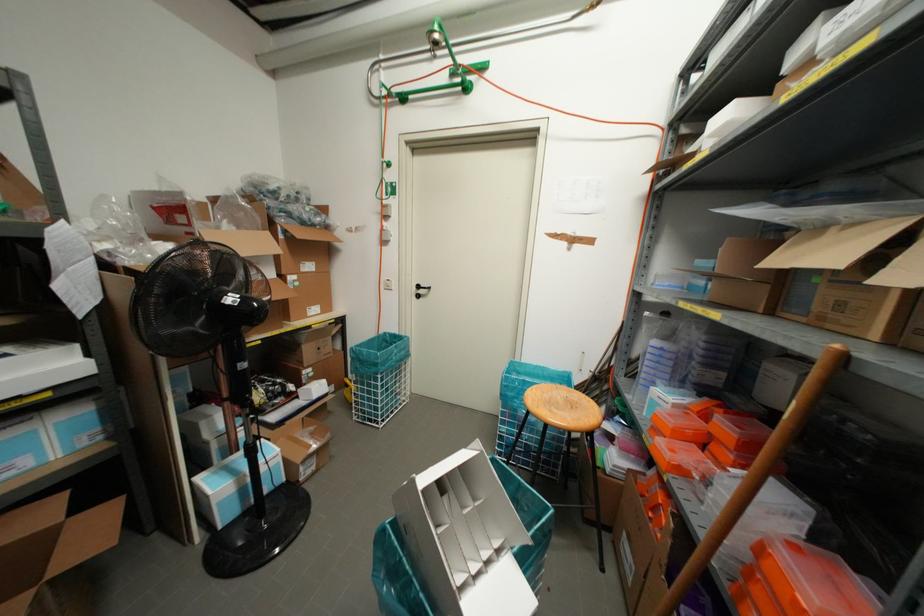
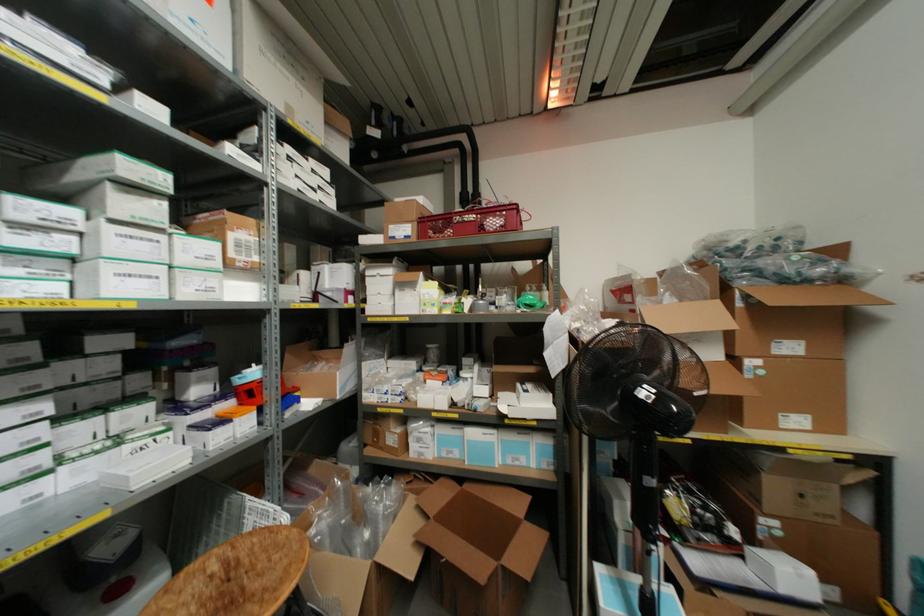
Question: The images are taken continuously from a first-person perspective. In which direction is your viewpoint rotating?

Choices:
 (A) Left
 (B) Right
 (C) Up
 (D) Down

Answer: (A)